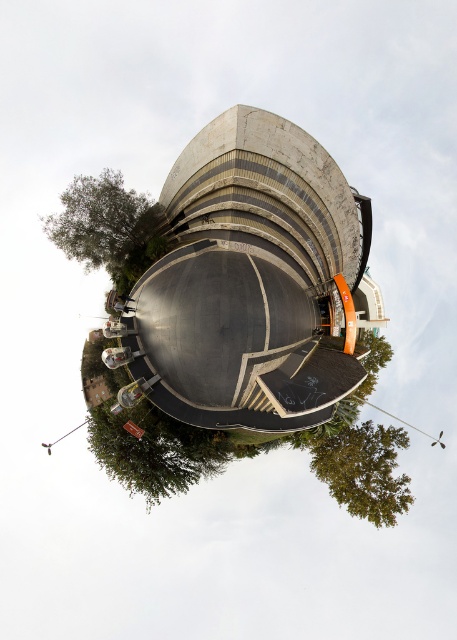
Question: Is green leafy tree at upper left further to the viewer compared to green leafy tree at lower right?

Choices:
 (A) no
 (B) yes

Answer: (B)

Question: Which point is farther from the camera taking this photo?

Choices:
 (A) (111, 241)
 (B) (387, 467)

Answer: (B)

Question: Which point is farther from the camera taking this photo?

Choices:
 (A) (120, 291)
 (B) (392, 452)

Answer: (B)

Question: Can you confirm if green leafy tree at upper left is positioned to the left of green leafy tree at lower right?

Choices:
 (A) no
 (B) yes

Answer: (B)

Question: Is green leafy tree at upper left above green leafy tree at lower right?

Choices:
 (A) no
 (B) yes

Answer: (B)